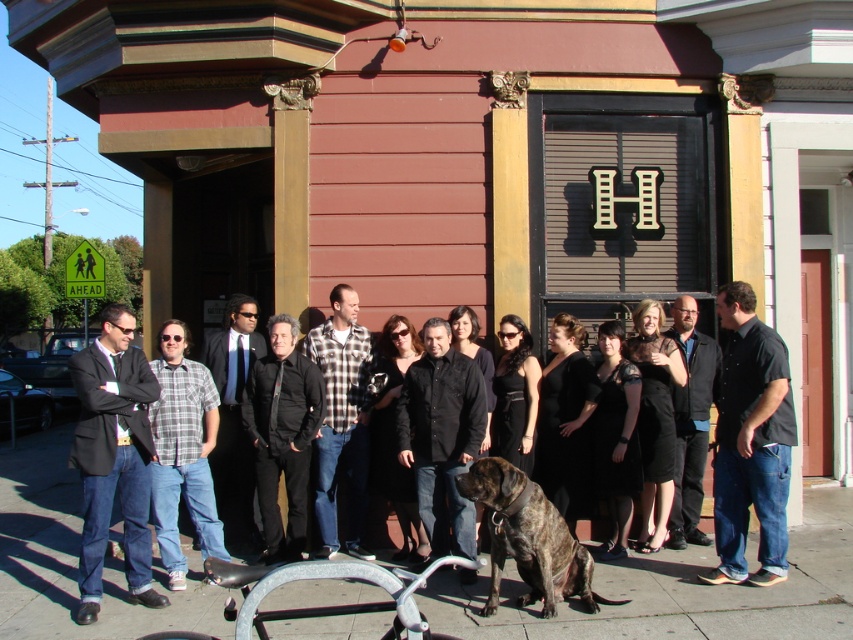
Question: Which object is closer to the camera taking this photo?

Choices:
 (A) black matte shirt at center
 (B) plaid flannel shirt at center

Answer: (A)

Question: Is the position of plaid flannel shirt at center more distant than that of black suit at center?

Choices:
 (A) no
 (B) yes

Answer: (A)

Question: Does brindle fur dog at center have a lesser width compared to black suit at center?

Choices:
 (A) yes
 (B) no

Answer: (B)

Question: Which object is the closest to the plaid flannel shirt at center?

Choices:
 (A) matte black suit at left
 (B) black suit at center
 (C) black leather jacket at center

Answer: (B)

Question: Which point is farther from the camera taking this photo?

Choices:
 (A) (343, 307)
 (B) (158, 394)
 (C) (529, 513)
 (D) (152, 428)

Answer: (A)

Question: Can you confirm if matte black suit at left is positioned to the left of brindle fur dog at center?

Choices:
 (A) no
 (B) yes

Answer: (B)